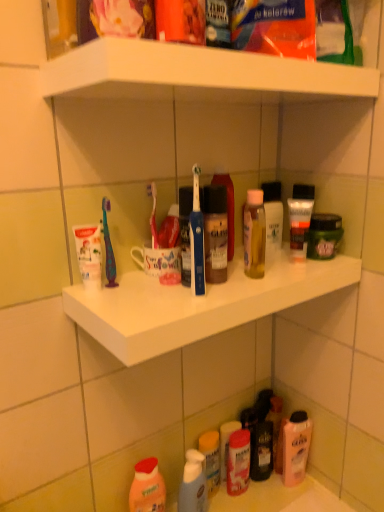
This screenshot has width=384, height=512. I want to click on free space above white plastic shelf at center (from a real-world perspective), so click(x=223, y=274).